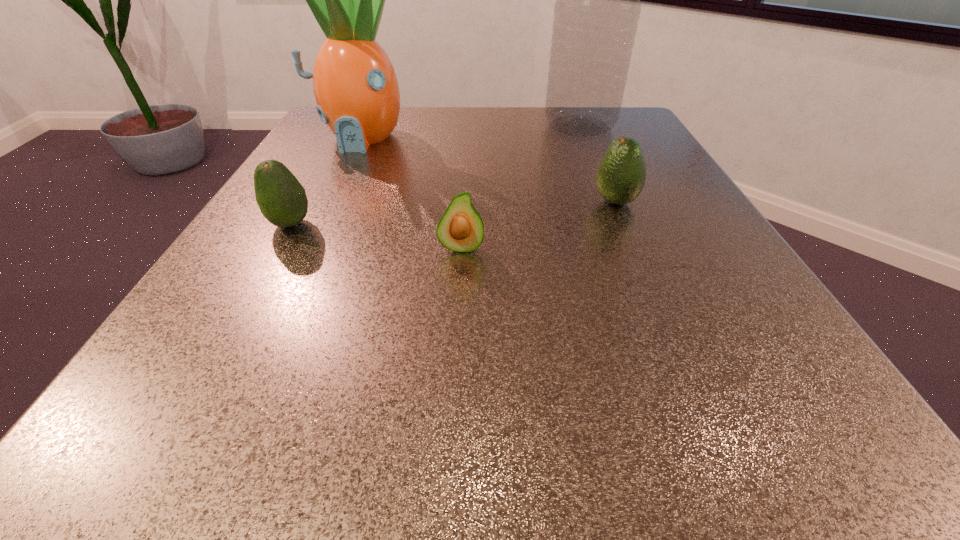
Locate an element on the screen. water jug is located at coordinates (597, 8).

Find the location of `pineapple`. pineapple is located at coordinates (356, 89).

Identify the location of the rightmost avocado. The image size is (960, 540). (621, 175).

This screenshot has width=960, height=540. Identify the location of the leftmost avocado. (282, 200).

Find the location of `the second avocado from left to right`. the second avocado from left to right is located at coordinates (460, 229).

This screenshot has width=960, height=540. I want to click on the third object from right to left, so click(460, 229).

At what (x,y) coordinates should I click in order to perform the action: click on vacant space located 0.400m on the left of the water jug. Please return your answer as a coordinate pair (x, y). This screenshot has height=540, width=960. Looking at the image, I should click on (374, 126).

This screenshot has width=960, height=540. Identify the location of vacant space located at the entrance of the pineapple. (305, 247).

You are a GUI agent. You are given a task and a screenshot of the screen. Output one action in this format:
    pyautogui.click(x=<x>, y=<y>)
    Task: Click on the vacant space situated on the left of the rightmost avocado
    This screenshot has width=960, height=540.
    Given the screenshot: What is the action you would take?
    pyautogui.click(x=524, y=202)

Where is `free spot located 0.080m on the front of the leftmost avocado`? The image size is (960, 540). free spot located 0.080m on the front of the leftmost avocado is located at coordinates (264, 271).